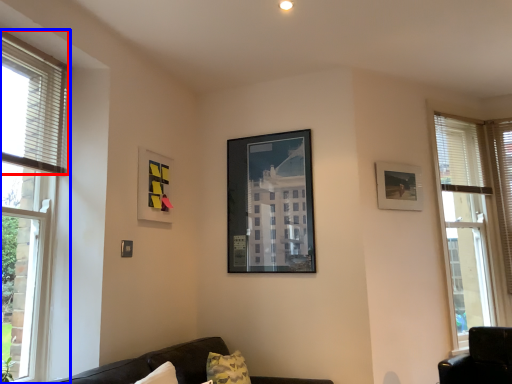
Question: Which object appears closest to the camera in this image, blind (highlighted by a red box) or window (highlighted by a blue box)?

Choices:
 (A) blind
 (B) window

Answer: (B)